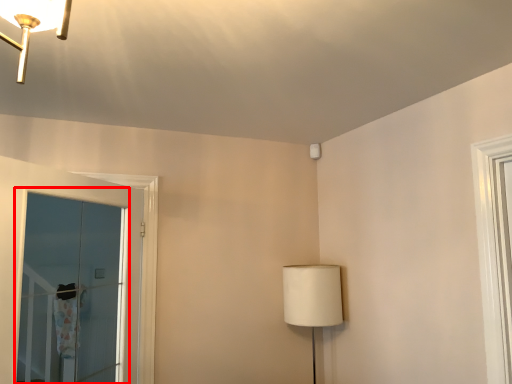
Question: From the image's perspective, what is the correct spatial relationship of window (annotated by the red box) in relation to table lamp?

Choices:
 (A) below
 (B) above

Answer: (B)